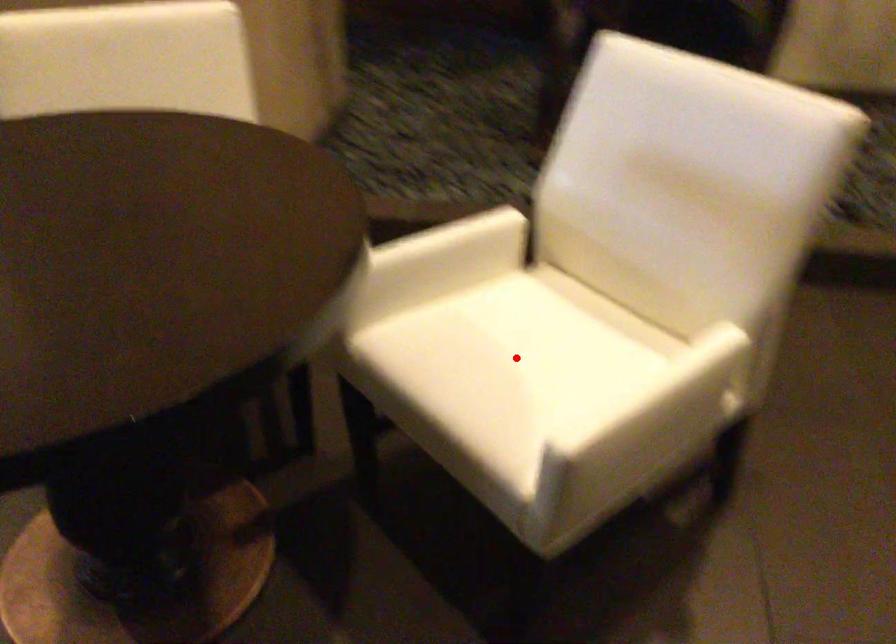
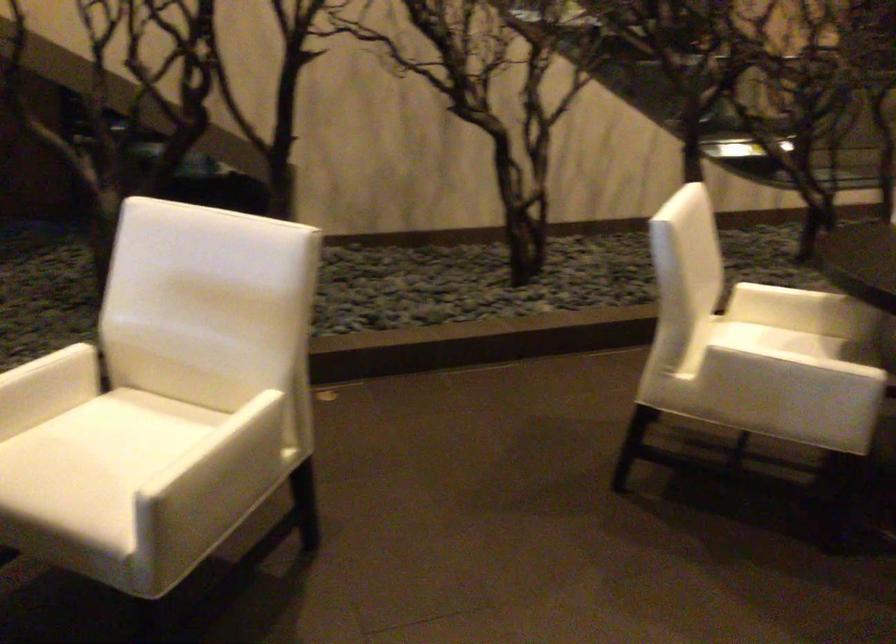
Question: I am providing you with two images of the same scene from different viewpoints. In image1, a red point is highlighted. Considering the same 3D point in image2, which of the following is correct?

Choices:
 (A) It is closer
 (B) It is farther

Answer: (B)